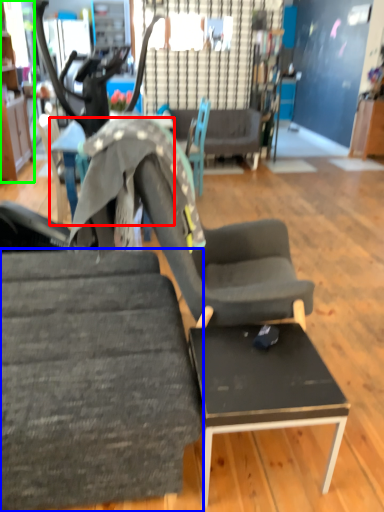
Question: Which object is positioned farthest from table (highlighted by a red box)? Select from chair (highlighted by a blue box) and cabinetry (highlighted by a green box).

Choices:
 (A) chair
 (B) cabinetry

Answer: (B)